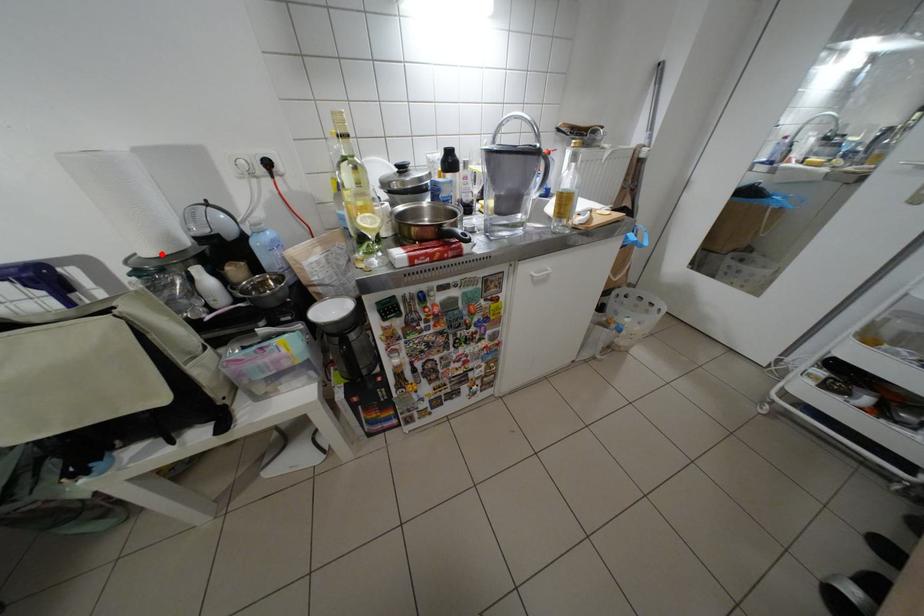
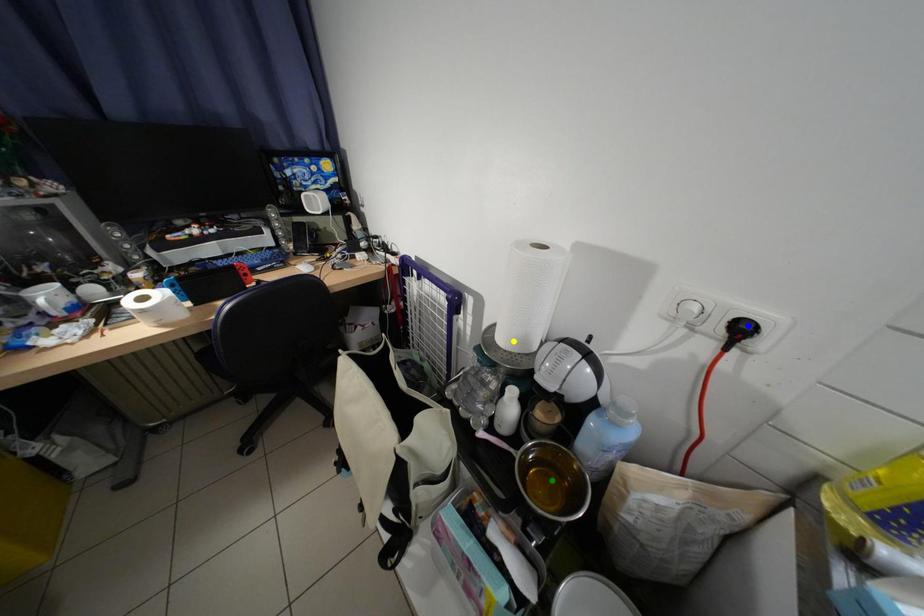
Question: I am providing you with two images of the same scene from different viewpoints. A red point is marked on the first image. You are given multiple points on the second image. Can you choose the point in image 2 that corresponds to the point in image 1?

Choices:
 (A) blue point
 (B) green point
 (C) yellow point

Answer: (C)